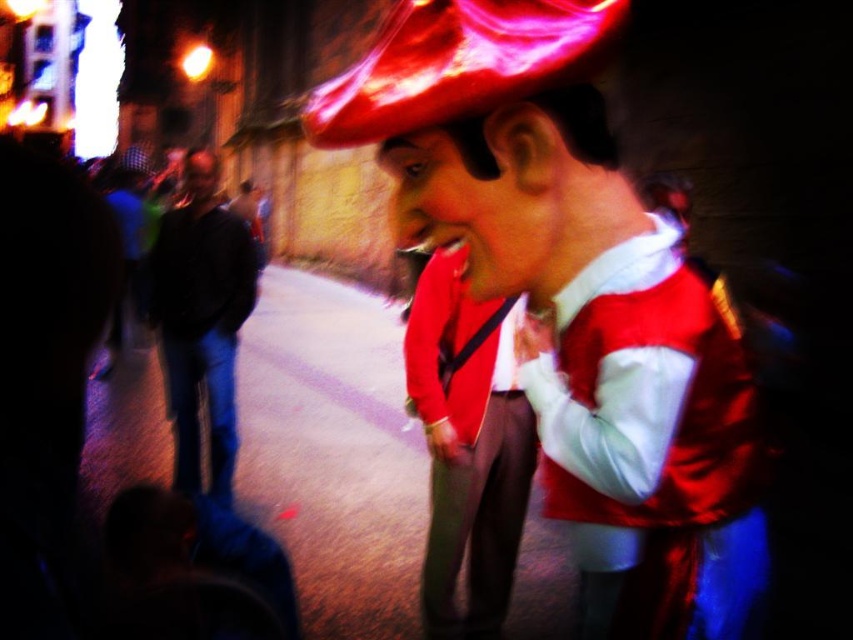
Question: Is shiny satin vest at center positioned before shiny red jacket at center?

Choices:
 (A) yes
 (B) no

Answer: (A)

Question: Does shiny satin vest at center come in front of black leather jacket at left?

Choices:
 (A) no
 (B) yes

Answer: (B)

Question: Which point is farther to the camera?

Choices:
 (A) (527, 428)
 (B) (251, 266)
 (C) (596, 513)

Answer: (B)

Question: Which object is farther from the camera taking this photo?

Choices:
 (A) shiny satin vest at center
 (B) shiny red jacket at center
 (C) black leather jacket at left

Answer: (C)

Question: Which point appears farthest from the camera in this image?

Choices:
 (A) (741, 384)
 (B) (469, 461)

Answer: (B)

Question: Can you confirm if shiny red jacket at center is positioned to the right of black leather jacket at left?

Choices:
 (A) yes
 (B) no

Answer: (A)